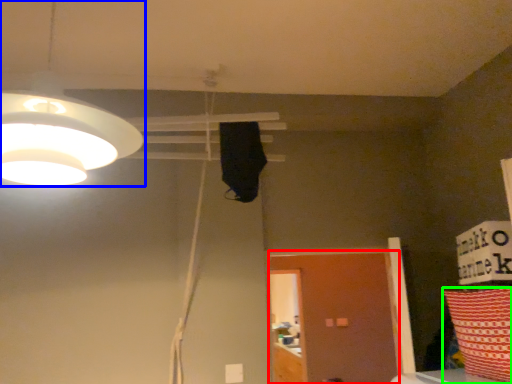
Question: Based on their relative distances, which object is nearer to door (highlighted by a red box)? Choose from lamp (highlighted by a blue box) and pillow (highlighted by a green box).

Choices:
 (A) lamp
 (B) pillow

Answer: (B)